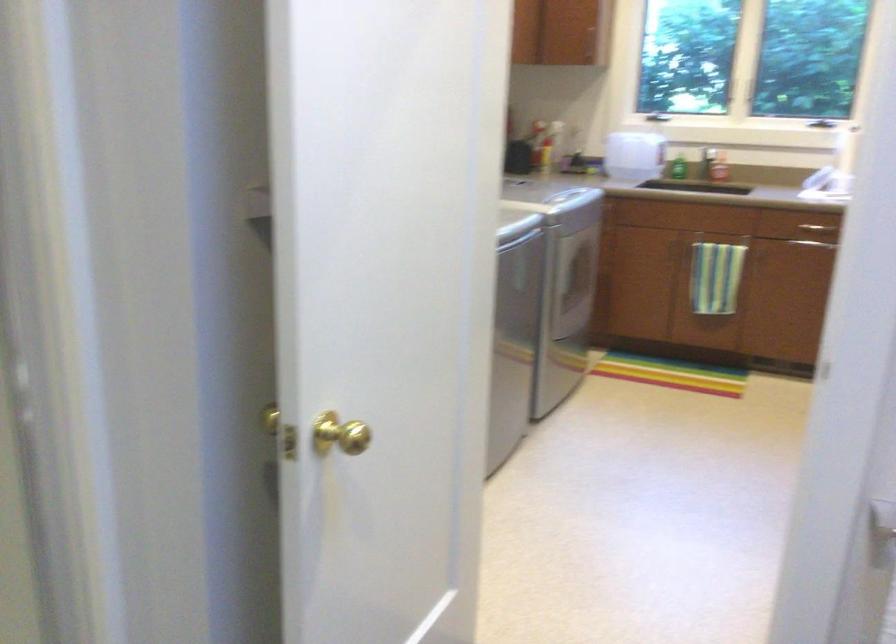
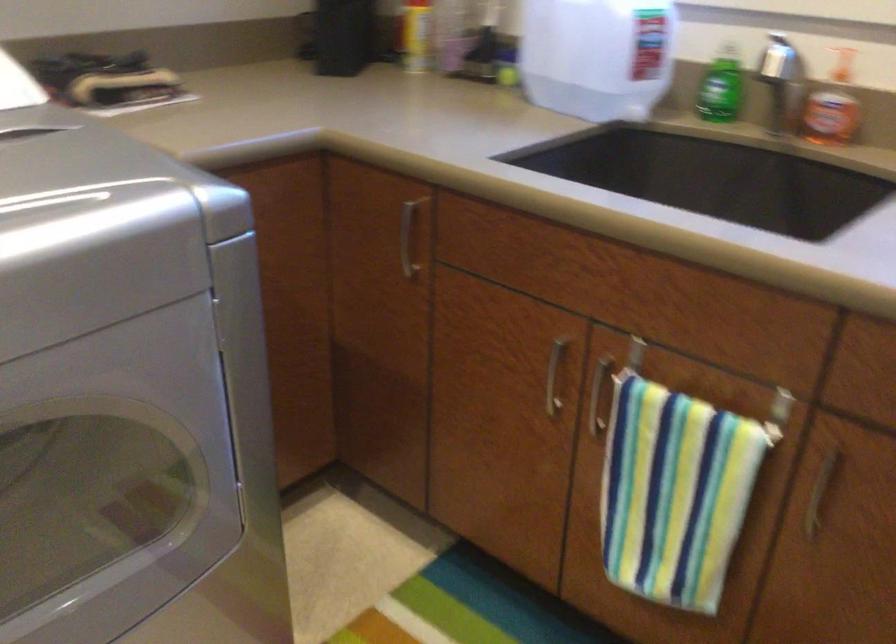
Locate, in the second image, the point that corresponds to point (642, 151) in the first image.

(597, 55)